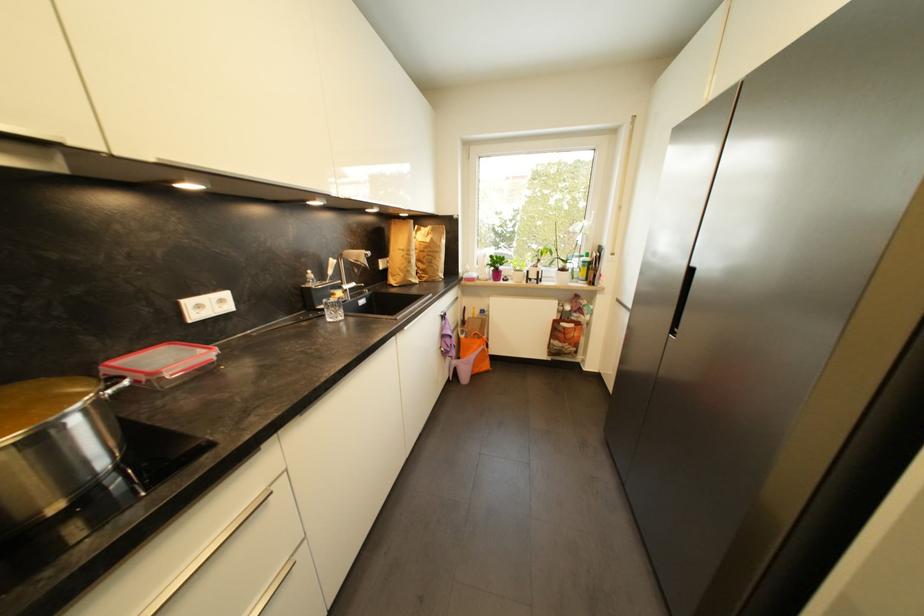
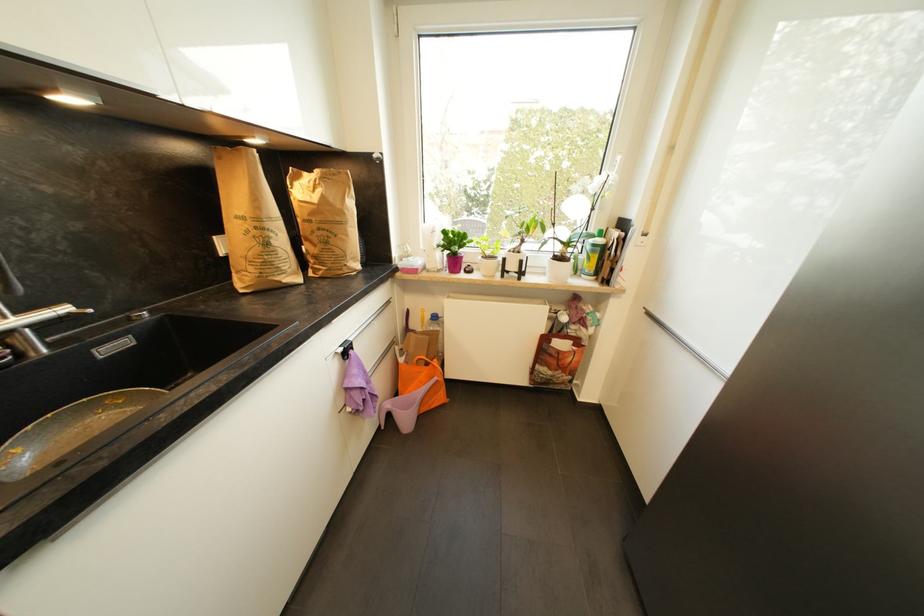
Where in the second image is the point corresponding to point (538, 278) from the first image?

(517, 268)